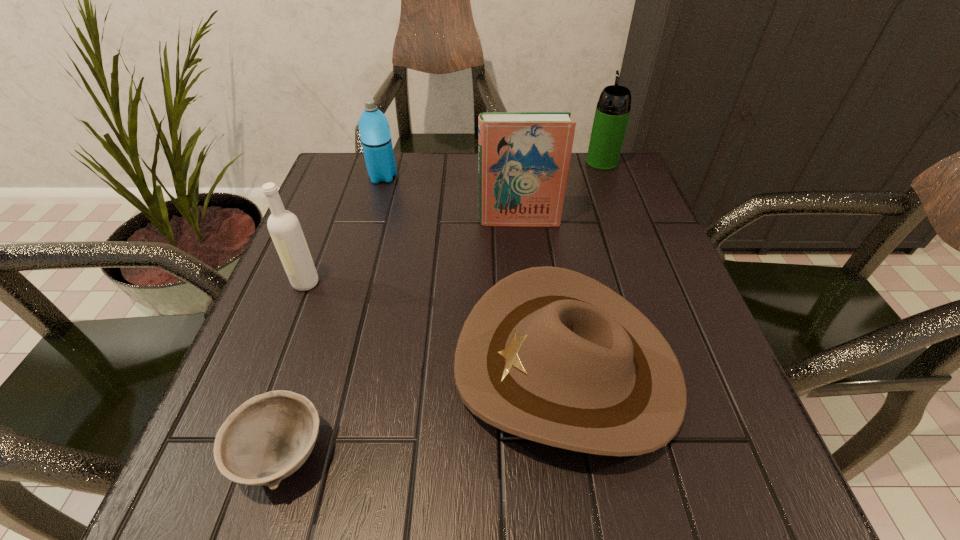
Locate an element on the screen. Image resolution: width=960 pixels, height=540 pixels. vacant space that's between the second shortest object and the vodka is located at coordinates [x=437, y=325].

You are a GUI agent. You are given a task and a screenshot of the screen. Output one action in this format:
    pyautogui.click(x=<x>, y=<y>)
    Task: Click on the free space between the right thermos bottle and the fifth tallest object
    The height and width of the screenshot is (540, 960).
    Given the screenshot: What is the action you would take?
    pyautogui.click(x=585, y=265)

Where is `vacant space that's between the shortest object and the right thermos bottle`? This screenshot has width=960, height=540. vacant space that's between the shortest object and the right thermos bottle is located at coordinates (442, 308).

Image resolution: width=960 pixels, height=540 pixels. In order to click on blank region between the right thermos bottle and the vodka in this screenshot , I will do `click(454, 222)`.

I want to click on free point between the left thermos bottle and the bowl, so click(332, 315).

At what (x,y) coordinates should I click in order to perform the action: click on object that stands as the third closest to the cowboy hat. Please return your answer as a coordinate pair (x, y). This screenshot has height=540, width=960. Looking at the image, I should click on (285, 230).

The width and height of the screenshot is (960, 540). In order to click on object identified as the second closest to the vodka in this screenshot , I will do `click(548, 354)`.